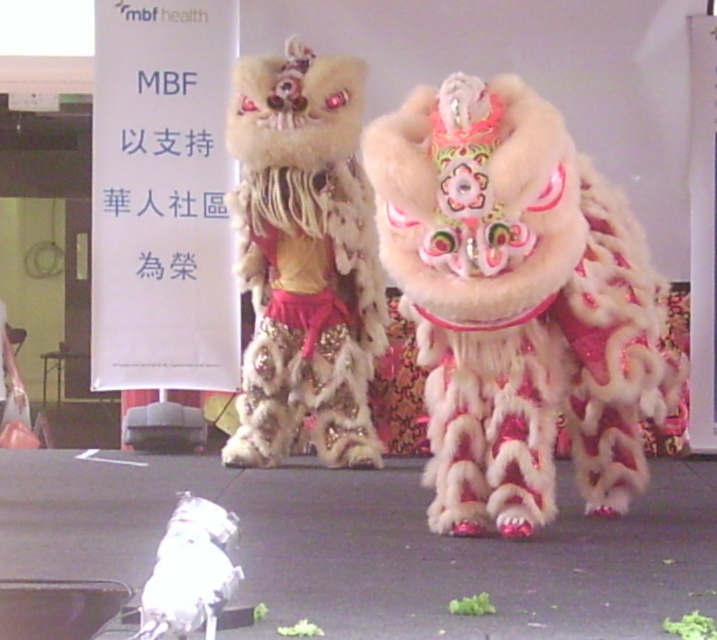
You are a photographer standing at the center of the stage where the two lion dance performers are positioned. You want to take a photo that includes both points marked as point 1 at (478, 516) and point 2 at (323, 154). However, you need to ensure that neither point is blocked by any part of the performers. Based on their positions, which point is closer to you, and therefore less likely to be obscured?

Point 1 at (478, 516) is in front of point 2 at (323, 154), so it is closer to you and less likely to be obscured.

You are a photographer taking a picture of the fuzzy beige lion at center and the white fluffy cat at lower left. Which animal should you focus on to ensure the other is partially hidden in the background?

You should focus on the fuzzy beige lion at center because the white fluffy cat at lower left is behind it, so focusing on the lion will keep the cat partially hidden in the background.

You are a photographer planning to take a photo of both the fuzzy white lion at center and the fuzzy beige lion at center during a performance. Since you want to ensure both lions are clearly visible in the frame, which lion should you focus on first to account for their size difference?

The fuzzy white lion at center is larger than the fuzzy beige lion at center, so you should focus on the fuzzy white lion at center first to ensure it fits well in the frame before adjusting for the smaller one.